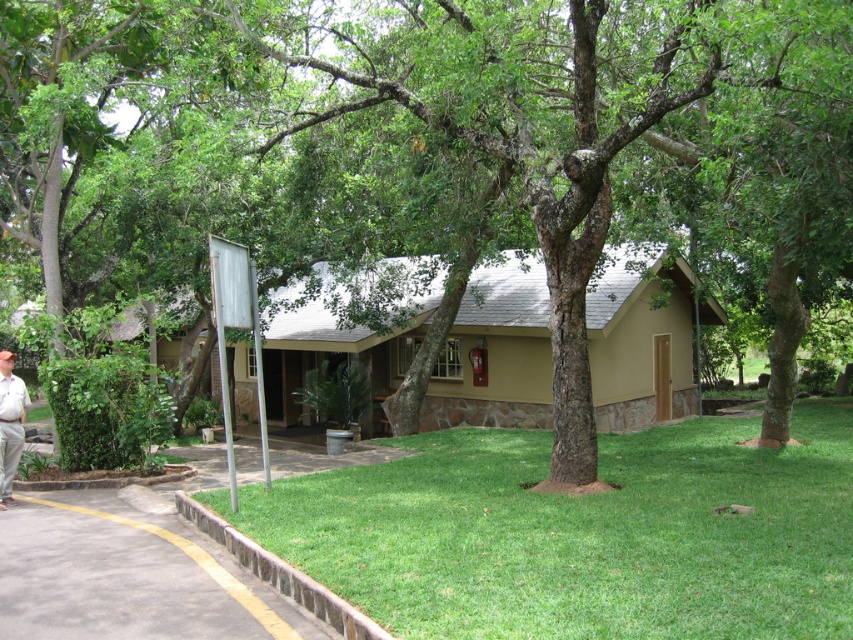
You are a gardener planning to plant flowers in the area. Given the green grass at lower center and the gray asphalt pavement at lower left, which area has more space available for planting?

The green grass at lower center has more space available for planting since it is bigger than the gray asphalt pavement at lower left.

In the scene shown: You are planning to install a new garden bed in the front yard. The garden bed requires a space that is wider than the light beige pants at lower left. Can the green grass at lower center accommodate this requirement?

The green grass at lower center has a larger width than the light beige pants at lower left, so it can accommodate the garden bed that requires a space wider than the light beige pants at lower left.

You are standing at the entrance of the building and want to walk straight ahead to the garden area. Is the green grass at lower center directly in front of you?

The green grass at lower center is located at point (581,532), which is directly in front of you at the entrance. So yes, the green grass at lower center is directly in front of you.